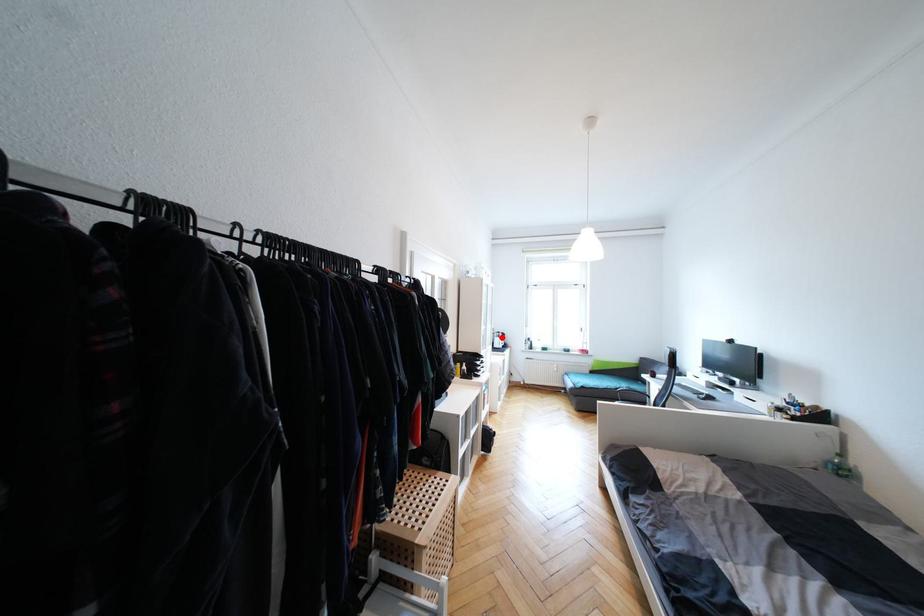
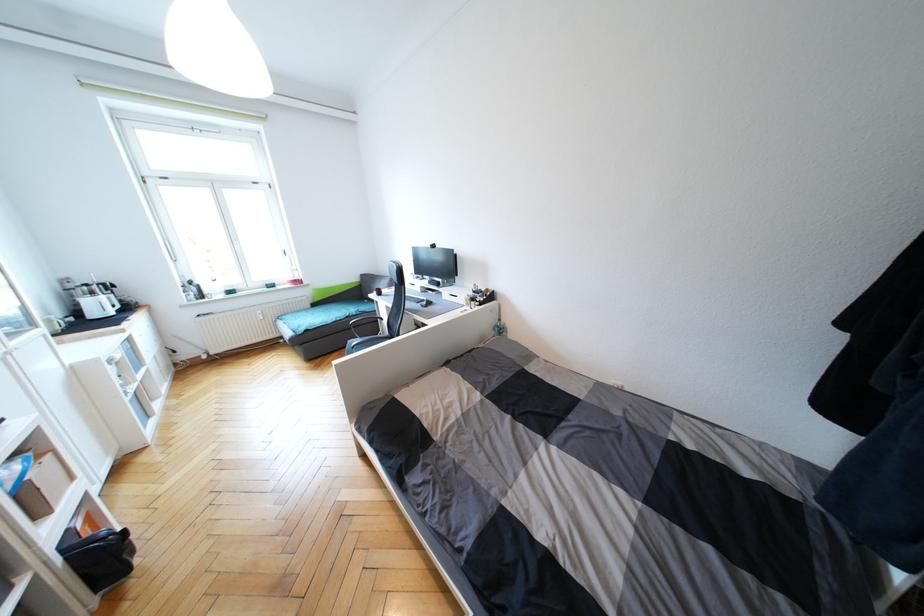
Find the pixel in the second image that matches the highlighted location in the first image.

(95, 294)